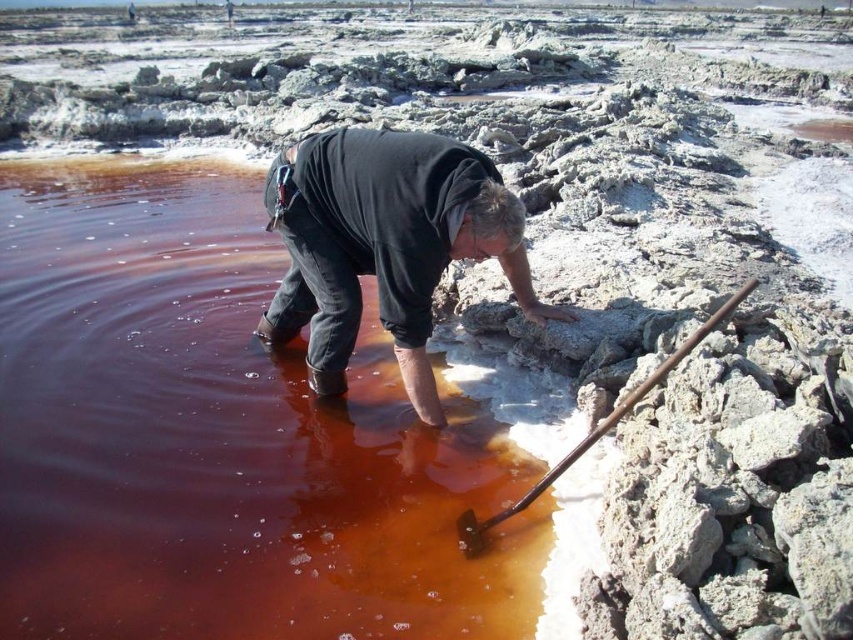
Does point (343, 170) lie in front of point (602, 420)?

No, it is behind (602, 420).

Is black cotton shirt at center to the right of rusty metal shovel at lower right from the viewer's perspective?

Incorrect, black cotton shirt at center is not on the right side of rusty metal shovel at lower right.

Image resolution: width=853 pixels, height=640 pixels. In order to click on black cotton shirt at center in this screenshot , I will do `click(386, 243)`.

Is brown liquid at lower left to the left of rusty metal shovel at lower right from the viewer's perspective?

Indeed, brown liquid at lower left is positioned on the left side of rusty metal shovel at lower right.

At what (x,y) coordinates should I click in order to perform the action: click on brown liquid at lower left. Please return your answer as a coordinate pair (x, y). Looking at the image, I should click on (219, 438).

This screenshot has height=640, width=853. In order to click on brown liquid at lower left in this screenshot , I will do `click(219, 438)`.

Which is below, brown liquid at lower left or black cotton shirt at center?

Positioned lower is brown liquid at lower left.

Is brown liquid at lower left above black cotton shirt at center?

No.

You are a GUI agent. You are given a task and a screenshot of the screen. Output one action in this format:
    pyautogui.click(x=<x>, y=<y>)
    Task: Click on the brown liquid at lower left
    The image size is (853, 640).
    Given the screenshot: What is the action you would take?
    pyautogui.click(x=219, y=438)